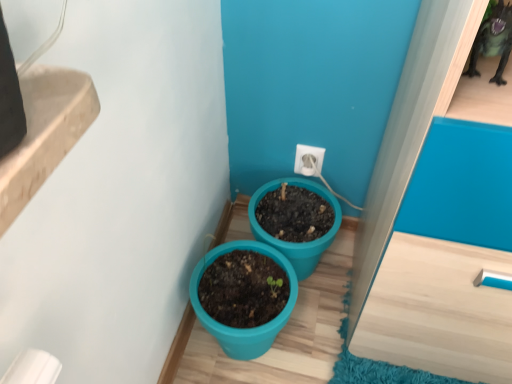
At what (x,y) coordinates should I click in order to perform the action: click on teal plastic pot at center, the 1th flowerpot in the left-to-right sequence. Please return your answer as a coordinate pair (x, y). The height and width of the screenshot is (384, 512). Looking at the image, I should click on (248, 328).

What is the approximate height of teal plastic pot at lower center, which is the second flowerpot in left-to-right order?

It is 9.27 inches.

Find the location of a particular element. teal plastic pot at center, which appears as the 2th flowerpot when viewed from the right is located at coordinates (248, 328).

Can you confirm if white plastic electric outlet at center is smaller than teal plastic pot at center, which appears as the 2th flowerpot when viewed from the right?

Correct, white plastic electric outlet at center occupies less space than teal plastic pot at center, which appears as the 2th flowerpot when viewed from the right.

Does white plastic electric outlet at center come behind teal plastic pot at center, the 1th flowerpot in the left-to-right sequence?

Yes, it is.

Can you tell me how much white plastic electric outlet at center and teal plastic pot at center, which appears as the 2th flowerpot when viewed from the right, differ in facing direction?

0.00589 degrees separate the facing orientations of white plastic electric outlet at center and teal plastic pot at center, which appears as the 2th flowerpot when viewed from the right.

Based on the photo, is white plastic electric outlet at center to the left or to the right of teal plastic pot at center, which appears as the 2th flowerpot when viewed from the right, in the image?

white plastic electric outlet at center is positioned on teal plastic pot at center, which appears as the 2th flowerpot when viewed from the right,'s right side.

Based on the photo, which of these two, teal plastic pot at lower center, which is the second flowerpot in left-to-right order, or teal plastic pot at center, which appears as the 2th flowerpot when viewed from the right, stands taller?

With more height is teal plastic pot at center, which appears as the 2th flowerpot when viewed from the right.

In the scene shown: Considering the relative sizes of teal plastic pot at lower center, the first flowerpot when ordered from right to left, and teal plastic pot at center, which appears as the 2th flowerpot when viewed from the right, in the image provided, is teal plastic pot at lower center, the first flowerpot when ordered from right to left, wider than teal plastic pot at center, which appears as the 2th flowerpot when viewed from the right,?

Yes.

Which is in front, teal plastic pot at lower center, which is the second flowerpot in left-to-right order, or teal plastic pot at center, which appears as the 2th flowerpot when viewed from the right?

teal plastic pot at center, which appears as the 2th flowerpot when viewed from the right, is in front.

Between teal plastic pot at center, which appears as the 2th flowerpot when viewed from the right, and teal plastic pot at lower center, the first flowerpot when ordered from right to left, which one has less height?

teal plastic pot at lower center, the first flowerpot when ordered from right to left, is shorter.

From the image's perspective, which one is positioned lower, teal plastic pot at center, the 1th flowerpot in the left-to-right sequence, or teal plastic pot at lower center, the first flowerpot when ordered from right to left?

teal plastic pot at center, the 1th flowerpot in the left-to-right sequence, appears lower in the image.

Is teal plastic pot at center, the 1th flowerpot in the left-to-right sequence, to the right of teal plastic pot at lower center, the first flowerpot when ordered from right to left, from the viewer's perspective?

In fact, teal plastic pot at center, the 1th flowerpot in the left-to-right sequence, is to the left of teal plastic pot at lower center, the first flowerpot when ordered from right to left.

Identify the location of flowerpot located on the right of teal plastic pot at center, the 1th flowerpot in the left-to-right sequence. (296, 243).

Is point (281, 250) more distant than point (296, 165)?

No, it is in front of (296, 165).

Considering the sizes of teal plastic pot at lower center, the first flowerpot when ordered from right to left, and white plastic electric outlet at center in the image, is teal plastic pot at lower center, the first flowerpot when ordered from right to left, wider or thinner than white plastic electric outlet at center?

teal plastic pot at lower center, the first flowerpot when ordered from right to left, is wider than white plastic electric outlet at center.

The image size is (512, 384). Find the location of `electric outlet located behind the teal plastic pot at lower center, which is the second flowerpot in left-to-right order`. electric outlet located behind the teal plastic pot at lower center, which is the second flowerpot in left-to-right order is located at coordinates (308, 160).

Considering the relative positions of teal plastic pot at lower center, which is the second flowerpot in left-to-right order, and white plastic electric outlet at center in the image provided, is teal plastic pot at lower center, which is the second flowerpot in left-to-right order, to the left or to the right of white plastic electric outlet at center?

Clearly, teal plastic pot at lower center, which is the second flowerpot in left-to-right order, is on the left of white plastic electric outlet at center in the image.

Between teal plastic pot at center, the 1th flowerpot in the left-to-right sequence, and white plastic electric outlet at center, which one has smaller width?

white plastic electric outlet at center.

Are teal plastic pot at center, which appears as the 2th flowerpot when viewed from the right, and white plastic electric outlet at center far apart?

No, teal plastic pot at center, which appears as the 2th flowerpot when viewed from the right, is not far from white plastic electric outlet at center.

From a real-world perspective, is teal plastic pot at center, which appears as the 2th flowerpot when viewed from the right, located beneath white plastic electric outlet at center?

Yes, from a real-world perspective, teal plastic pot at center, which appears as the 2th flowerpot when viewed from the right, is under white plastic electric outlet at center.

Is teal plastic pot at center, which appears as the 2th flowerpot when viewed from the right, outside of white plastic electric outlet at center?

teal plastic pot at center, which appears as the 2th flowerpot when viewed from the right, lies outside white plastic electric outlet at center's area.

Is white plastic electric outlet at center completely or partially outside of teal plastic pot at lower center, the first flowerpot when ordered from right to left?

white plastic electric outlet at center lies outside teal plastic pot at lower center, the first flowerpot when ordered from right to left,'s area.

Based on the photo, can you confirm if white plastic electric outlet at center is taller than teal plastic pot at lower center, which is the second flowerpot in left-to-right order?

No, white plastic electric outlet at center is not taller than teal plastic pot at lower center, which is the second flowerpot in left-to-right order.

In the image, there is a teal plastic pot at lower center, the first flowerpot when ordered from right to left. Identify the location of electric outlet above it (from the image's perspective). (308, 160).

You are a GUI agent. You are given a task and a screenshot of the screen. Output one action in this format:
    pyautogui.click(x=<x>, y=<y>)
    Task: Click on the electric outlet positioned vertically above the teal plastic pot at center, which appears as the 2th flowerpot when viewed from the right (from a real-world perspective)
    Image resolution: width=512 pixels, height=384 pixels.
    Given the screenshot: What is the action you would take?
    pyautogui.click(x=308, y=160)

Locate an element on the screen. flowerpot lying in front of the teal plastic pot at lower center, which is the second flowerpot in left-to-right order is located at coordinates (248, 328).

When comparing their distances from teal plastic pot at lower center, which is the second flowerpot in left-to-right order, does white plastic electric outlet at center or teal plastic pot at center, which appears as the 2th flowerpot when viewed from the right, seem closer?

teal plastic pot at center, which appears as the 2th flowerpot when viewed from the right.

From the image, which object appears to be farther from teal plastic pot at center, which appears as the 2th flowerpot when viewed from the right, white plastic electric outlet at center or teal plastic pot at lower center, which is the second flowerpot in left-to-right order?

white plastic electric outlet at center lies further to teal plastic pot at center, which appears as the 2th flowerpot when viewed from the right, than the other object.

Considering their positions, is teal plastic pot at lower center, which is the second flowerpot in left-to-right order, positioned closer to teal plastic pot at center, which appears as the 2th flowerpot when viewed from the right, than white plastic electric outlet at center?

teal plastic pot at lower center, which is the second flowerpot in left-to-right order, is closer to teal plastic pot at center, which appears as the 2th flowerpot when viewed from the right.

Considering their positions, is teal plastic pot at lower center, the first flowerpot when ordered from right to left, positioned closer to white plastic electric outlet at center than teal plastic pot at center, which appears as the 2th flowerpot when viewed from the right?

teal plastic pot at lower center, the first flowerpot when ordered from right to left, lies closer to white plastic electric outlet at center than the other object.

Considering their positions, is teal plastic pot at center, the 1th flowerpot in the left-to-right sequence, positioned closer to teal plastic pot at lower center, which is the second flowerpot in left-to-right order, than white plastic electric outlet at center?

The object closer to teal plastic pot at lower center, which is the second flowerpot in left-to-right order, is teal plastic pot at center, the 1th flowerpot in the left-to-right sequence.

Based on their spatial positions, is teal plastic pot at center, the 1th flowerpot in the left-to-right sequence, or teal plastic pot at lower center, which is the second flowerpot in left-to-right order, closer to white plastic electric outlet at center?

teal plastic pot at lower center, which is the second flowerpot in left-to-right order, is closer to white plastic electric outlet at center.

This screenshot has height=384, width=512. I want to click on flowerpot that lies between white plastic electric outlet at center and teal plastic pot at center, which appears as the 2th flowerpot when viewed from the right, from top to bottom, so click(296, 243).